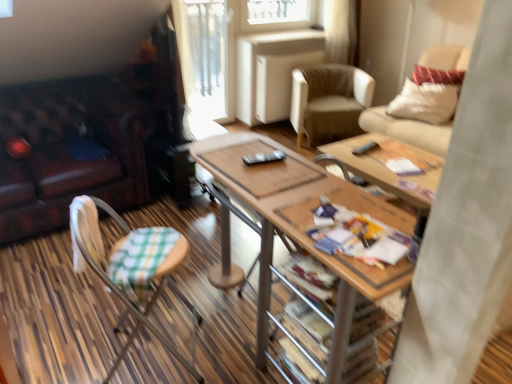
The width and height of the screenshot is (512, 384). I want to click on vacant area that is in front of black plastic remote control at center, which appears as the first remote control when viewed from the right, so click(387, 161).